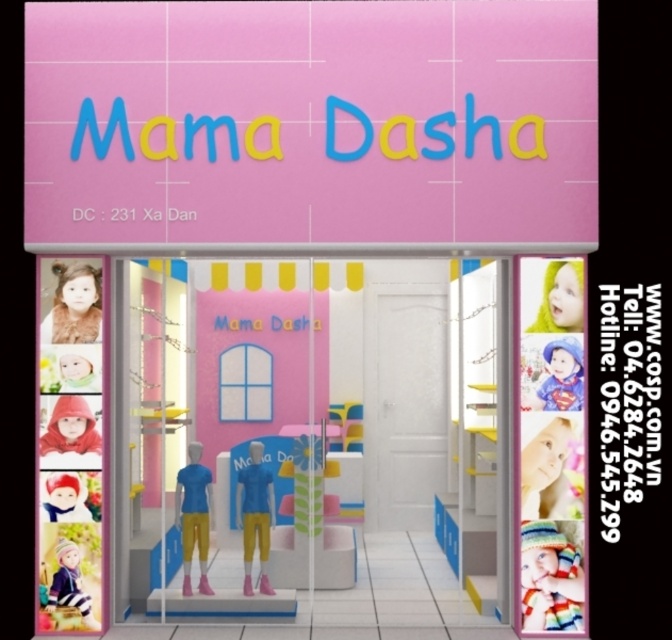
Question: Which of the following is the farthest from the observer?

Choices:
 (A) matte blue doll at center
 (B) pink glossy shop window at center
 (C) matte pink barbie at lower left
 (D) pastel blonde hair doll at upper right

Answer: (B)

Question: Considering the real-world distances, which object is closest to the striped knit hat at center?

Choices:
 (A) transparent glass window at center
 (B) striped woolen hat at lower left

Answer: (B)

Question: Does smooth plastic barbie at upper right appear under white plush barbie at lower left?

Choices:
 (A) no
 (B) yes

Answer: (A)

Question: Is striped knit hat at center bigger than transparent glass window at center?

Choices:
 (A) no
 (B) yes

Answer: (A)

Question: Is smooth plastic barbie at upper right below fur coat at lower left?

Choices:
 (A) no
 (B) yes

Answer: (B)

Question: Estimate the real-world distances between objects in this image. Which object is closer to the striped knit hat at center?

Choices:
 (A) white plush barbie at lower left
 (B) matte blue doll at center
 (C) matte pink barbie at lower left

Answer: (B)